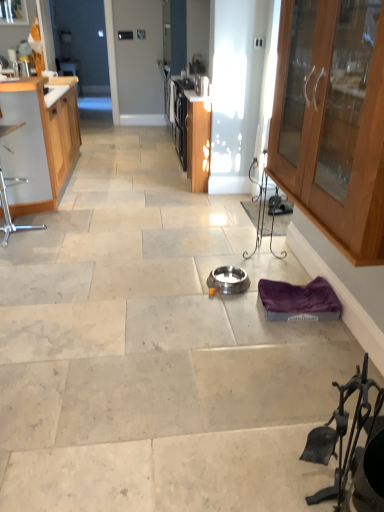
Locate an element on the screen. free region under wooden cabinet at right, which is the first cabinetry from front to back (from a real-world perspective) is located at coordinates point(321,337).